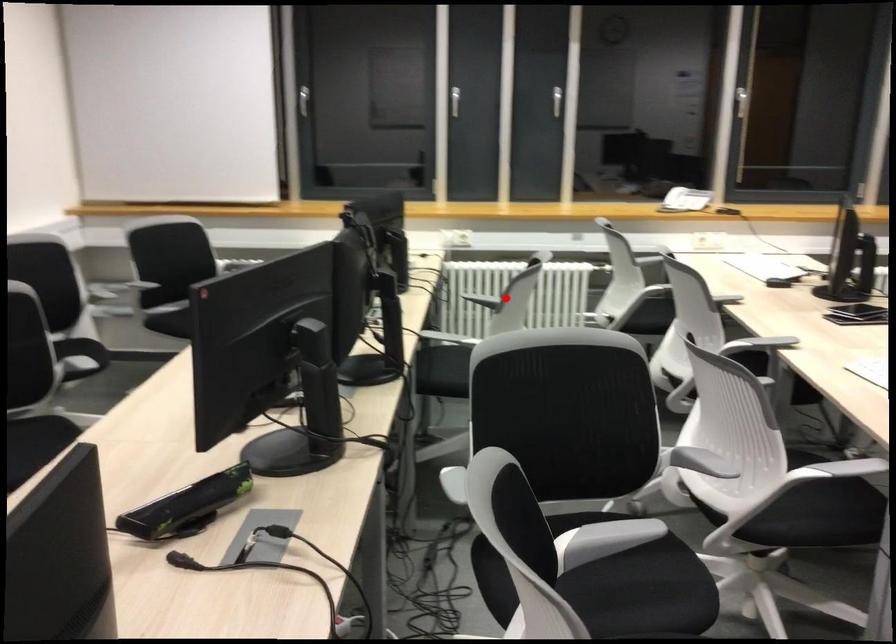
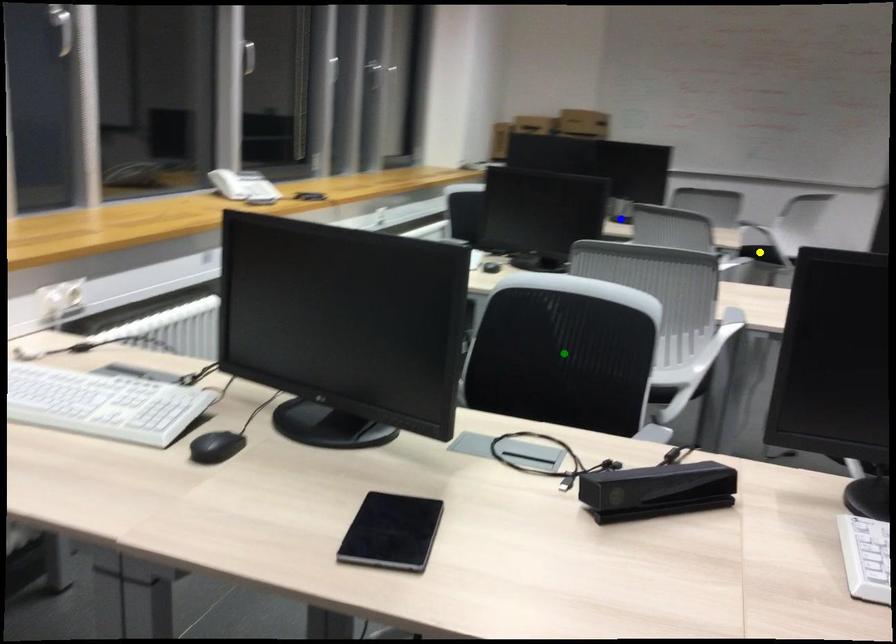
Question: I am providing you with two images of the same scene from different viewpoints. A red point is marked on the first image. You are given multiple points on the second image. Which point in image 2 represents the same 3d spot as the red point in image 1?

Choices:
 (A) yellow point
 (B) green point
 (C) blue point

Answer: (B)